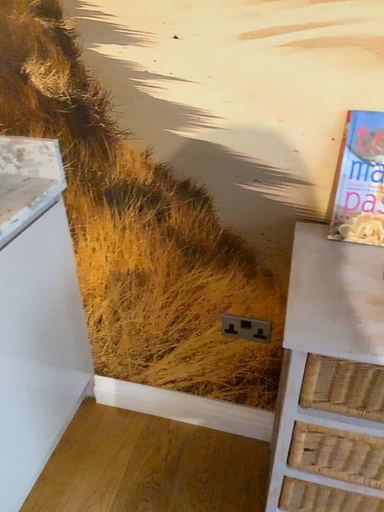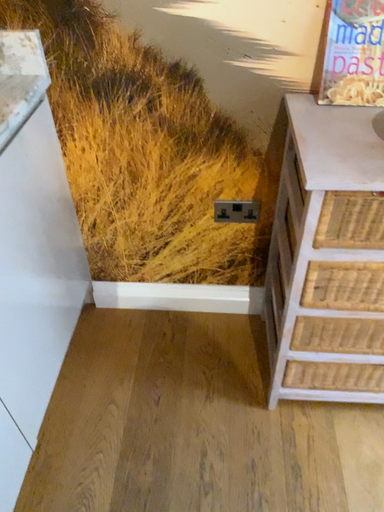
Question: How did the camera likely rotate when shooting the video?

Choices:
 (A) rotated downward
 (B) rotated upward

Answer: (A)